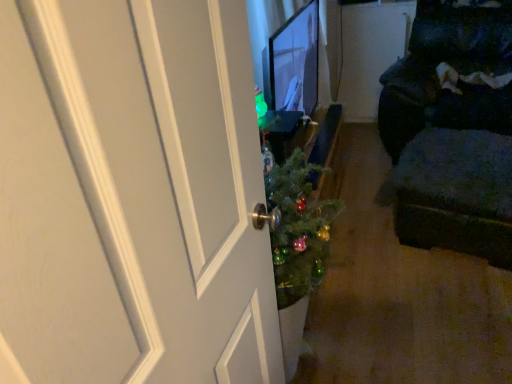
The height and width of the screenshot is (384, 512). In order to click on vacant space situated on the left part of dark fabric ottoman at right in this screenshot , I will do `click(369, 254)`.